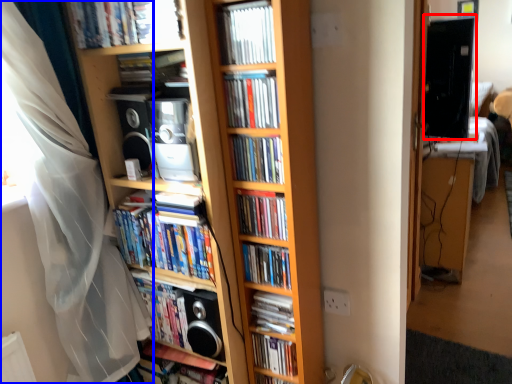
Question: Which object appears closest to the camera in this image, computer monitor (highlighted by a red box) or curtain (highlighted by a blue box)?

Choices:
 (A) computer monitor
 (B) curtain

Answer: (B)